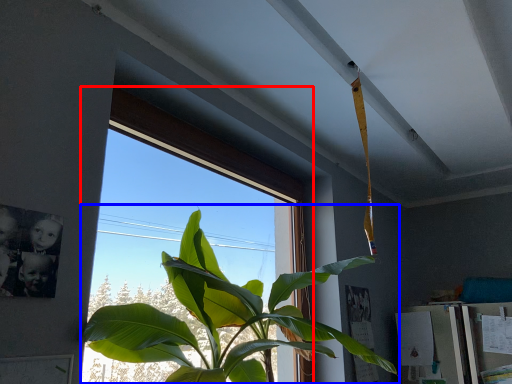
Question: Which object appears closest to the camera in this image, window (highlighted by a red box) or houseplant (highlighted by a blue box)?

Choices:
 (A) window
 (B) houseplant

Answer: (B)